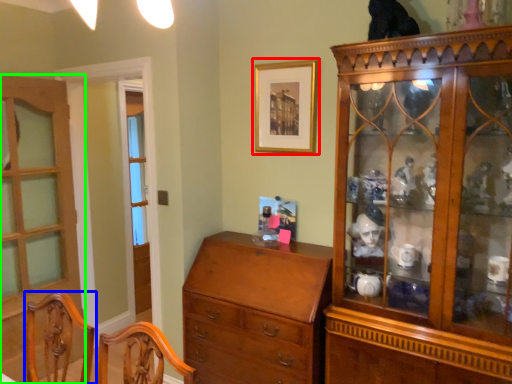
Question: Which is farther away from picture frame (highlighted by a red box)? chair (highlighted by a blue box) or door (highlighted by a green box)?

Choices:
 (A) chair
 (B) door

Answer: (B)